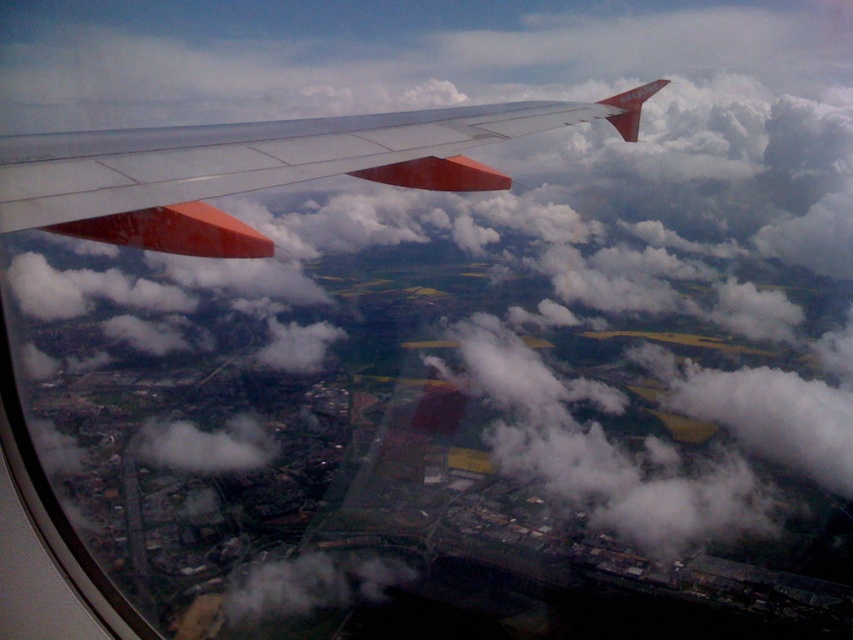
You are a pilot looking out the airplane window. You notice two white fluffy clouds below you. Which one is closer to the ground? The white fluffy cloud at lower center or the white fluffy cloud at lower left?

The white fluffy cloud at lower center is positioned under the white fluffy cloud at lower left, so the white fluffy cloud at lower center is closer to the ground.